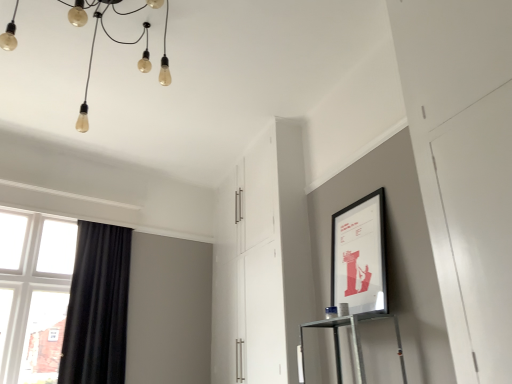
Question: From a real-world perspective, is white glossy cabinet at center positioned above or below clear glass window at left?

Choices:
 (A) below
 (B) above

Answer: (B)

Question: Considering their positions, is white glossy cabinet at center located in front of or behind clear glass window at left?

Choices:
 (A) behind
 (B) front

Answer: (B)

Question: Which of these objects is positioned closest to the translucent glass lightbulbs at upper left?

Choices:
 (A) white glossy cabinet at center
 (B) black velvet curtain at left
 (C) matte black picture frame at upper right
 (D) clear glass window at left

Answer: (A)

Question: Based on their relative distances, which object is nearer to the black velvet curtain at left?

Choices:
 (A) matte black picture frame at upper right
 (B) white glossy cabinet at center
 (C) clear glass window at left
 (D) translucent glass lightbulbs at upper left

Answer: (C)